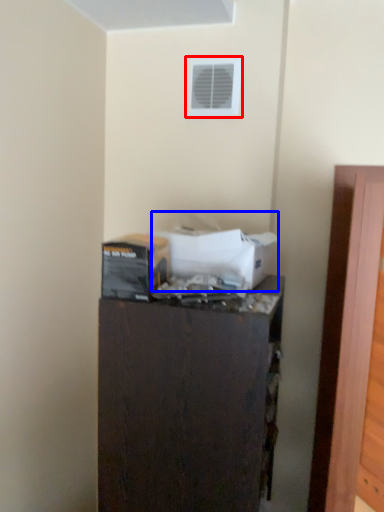
Question: Among these objects, which one is nearest to the camera, air conditioning (highlighted by a red box) or box (highlighted by a blue box)?

Choices:
 (A) air conditioning
 (B) box

Answer: (B)